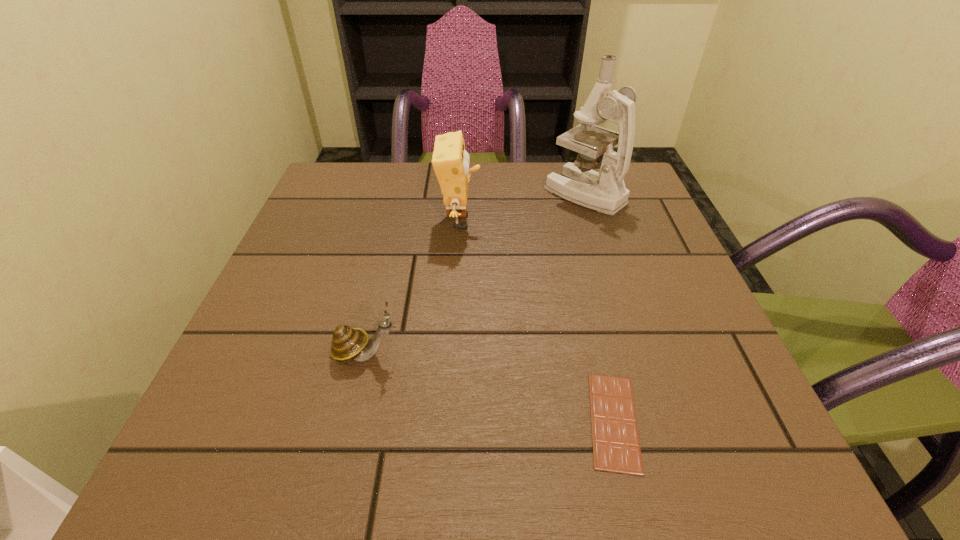
Locate an element on the screen. The width and height of the screenshot is (960, 540). vacant space that's between the tallest object and the second tallest object is located at coordinates pyautogui.click(x=522, y=208).

Where is `free area in between the third shortest object and the chocolate bar`? Image resolution: width=960 pixels, height=540 pixels. free area in between the third shortest object and the chocolate bar is located at coordinates (537, 321).

You are a GUI agent. You are given a task and a screenshot of the screen. Output one action in this format:
    pyautogui.click(x=<x>, y=<y>)
    Task: Click on the free area in between the nearest object and the third object from right to left
    This screenshot has width=960, height=540.
    Given the screenshot: What is the action you would take?
    pyautogui.click(x=537, y=321)

Locate which object is the second closest to the microscope. Please provide its 2D coordinates. Your answer should be formatted as a tuple, i.e. [(x, y)], where the tuple contains the x and y coordinates of a point satisfying the conditions above.

[(616, 448)]

You are a GUI agent. You are given a task and a screenshot of the screen. Output one action in this format:
    pyautogui.click(x=<x>, y=<y>)
    Task: Click on the closest object relative to the second tallest object
    The width and height of the screenshot is (960, 540).
    Given the screenshot: What is the action you would take?
    pyautogui.click(x=605, y=192)

What are the coordinates of `vacant region that satisfies the following two spatial constraints: 1. on the face of the second object from left to right; 2. on the right side of the shortest object` in the screenshot? It's located at (448, 421).

Where is `vacant space that satisfies the following two spatial constraints: 1. on the back side of the nearest object; 2. on the face of the leftmost object`? This screenshot has height=540, width=960. vacant space that satisfies the following two spatial constraints: 1. on the back side of the nearest object; 2. on the face of the leftmost object is located at coordinates (597, 354).

Where is `free space that satisfies the following two spatial constraints: 1. on the face of the third object from right to left; 2. on the left side of the shortest object`? free space that satisfies the following two spatial constraints: 1. on the face of the third object from right to left; 2. on the left side of the shortest object is located at coordinates (448, 421).

Identify the location of vacant region that satisfies the following two spatial constraints: 1. on the face of the shortest object; 2. on the left side of the leftmost object. This screenshot has height=540, width=960. (349, 421).